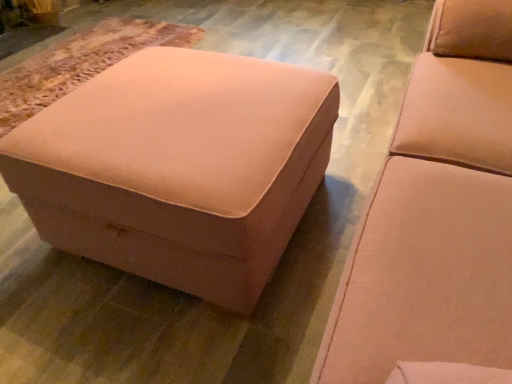
Image resolution: width=512 pixels, height=384 pixels. Identify the location of suede ottoman at center. pos(178,167).

Describe the element at coordinates (178, 167) in the screenshot. I see `suede ottoman at center` at that location.

The width and height of the screenshot is (512, 384). What are the coordinates of `suede ottoman at center` in the screenshot? It's located at point(178,167).